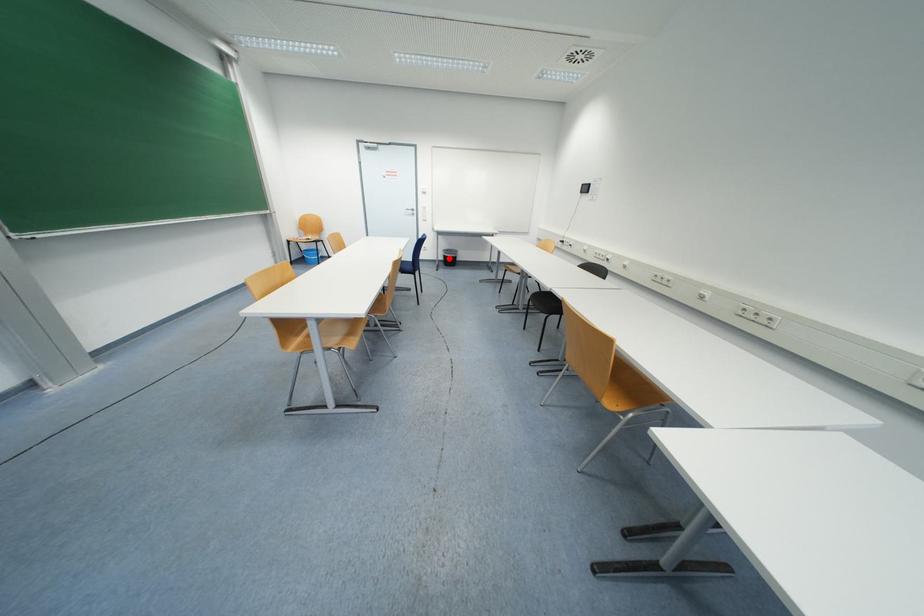
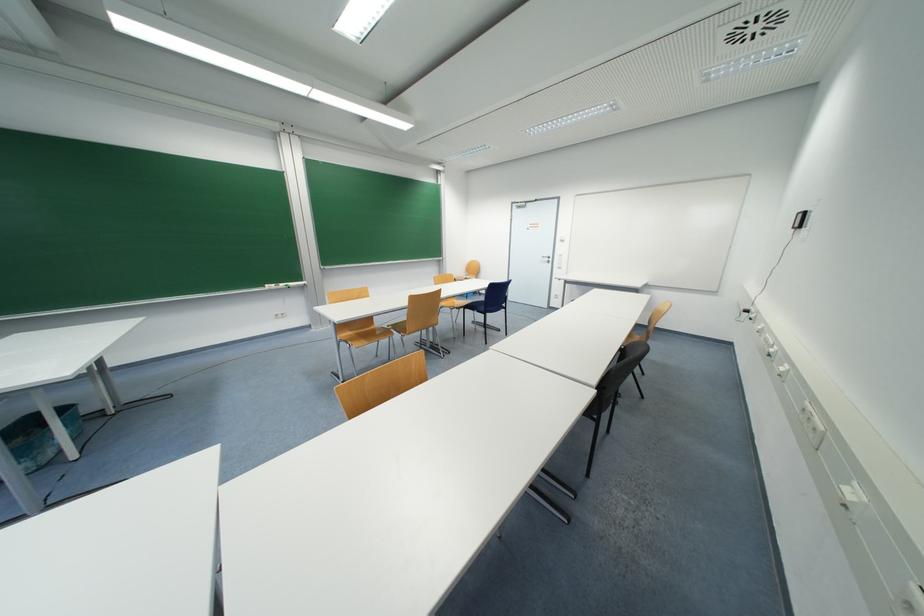
Question: I am providing you with two images of the same scene from different viewpoints. A red point is marked on the first image. Can you still see the location of the red point in image 2?

Choices:
 (A) Yes
 (B) No

Answer: (B)